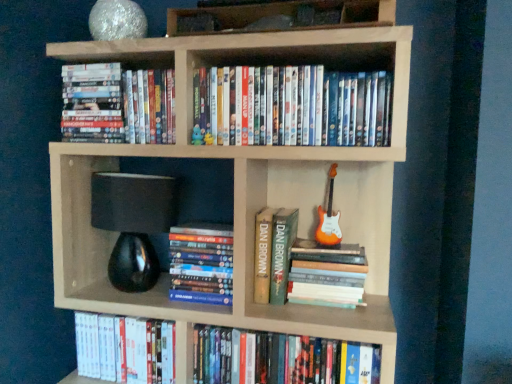
The image size is (512, 384). What do you see at coordinates (292, 106) in the screenshot?
I see `matte plastic dvds at upper center, positioned as the second book in top-to-bottom order` at bounding box center [292, 106].

How much space does hardcover book at center, placed as the fifth book when sorted from top to bottom, occupy vertically?

hardcover book at center, placed as the fifth book when sorted from top to bottom, is 6.28 inches tall.

The height and width of the screenshot is (384, 512). I want to click on hardcover book at lower center, which ranks as the seventh book in top-to-bottom order, so click(x=280, y=358).

What do you see at coordinates (282, 253) in the screenshot?
I see `green hardcover book at center, acting as the 3th book starting from the top` at bounding box center [282, 253].

The image size is (512, 384). I want to click on matte plastic dvds at upper center, positioned as the second book in top-to-bottom order, so click(x=292, y=106).

Based on their sizes in the image, would you say orange glossy electric guitar at right is bigger or smaller than wooden books at upper center?

Considering their sizes, orange glossy electric guitar at right takes up less space than wooden books at upper center.

Considering their positions, is orange glossy electric guitar at right located in front of or behind wooden books at upper center?

orange glossy electric guitar at right is behind wooden books at upper center.

Based on their positions, is orange glossy electric guitar at right located to the left or right of wooden books at upper center?

Clearly, orange glossy electric guitar at right is on the right of wooden books at upper center in the image.

Is hardcover book at center, placed as the fifth book when sorted from top to bottom, a part of matte blue plush toy at upper center?

No.

Is matte blue plush toy at upper center wider or thinner than hardcover book at center, positioned as the third book in bottom-to-top order?

Considering their sizes, matte blue plush toy at upper center looks slimmer than hardcover book at center, positioned as the third book in bottom-to-top order.

Can you confirm if matte blue plush toy at upper center is positioned to the left of hardcover book at center, positioned as the third book in bottom-to-top order?

Yes.

From a real-world perspective, which is physically above, matte blue plush toy at upper center or hardcover book at center, placed as the fifth book when sorted from top to bottom?

From a 3D spatial view, matte blue plush toy at upper center is above.

Locate an element on the screen. The height and width of the screenshot is (384, 512). guitar above the natural wood bookcase at upper center (from a real-world perspective) is located at coordinates (329, 216).

Is natural wood bookcase at upper center a part of orange glossy electric guitar at right?

No, natural wood bookcase at upper center is not inside orange glossy electric guitar at right.

Between orange glossy electric guitar at right and natural wood bookcase at upper center, which one is positioned in front?

natural wood bookcase at upper center is more forward.

Which object is thinner, orange glossy electric guitar at right or natural wood bookcase at upper center?

Thinner between the two is orange glossy electric guitar at right.

Considering the points (281, 264) and (320, 222), which point is in front, point (281, 264) or point (320, 222)?

Point (281, 264)

Find the location of a particular element. book that is the 1st one when counting downward from the orange glossy electric guitar at right (from the image's perspective) is located at coordinates pos(282,253).

Is green hardcover book at center, acting as the 3th book starting from the top, not close to orange glossy electric guitar at right?

No, green hardcover book at center, acting as the 3th book starting from the top, is not far from orange glossy electric guitar at right.

From a real-world perspective, who is located higher, white glossy dvds at upper left, positioned as the 1th book in top-to-bottom order, or matte plastic dvds at upper center, the 6th book in the bottom-to-top sequence?

white glossy dvds at upper left, positioned as the 1th book in top-to-bottom order, is physically above.

Considering the sizes of objects white glossy dvds at upper left, positioned as the 1th book in top-to-bottom order, and matte plastic dvds at upper center, positioned as the second book in top-to-bottom order, in the image provided, who is taller, white glossy dvds at upper left, positioned as the 1th book in top-to-bottom order, or matte plastic dvds at upper center, positioned as the second book in top-to-bottom order,?

Standing taller between the two is white glossy dvds at upper left, positioned as the 1th book in top-to-bottom order.

From the picture: Is white glossy dvds at upper left, positioned as the 1th book in top-to-bottom order, positioned with its back to matte plastic dvds at upper center, the 6th book in the bottom-to-top sequence?

No, white glossy dvds at upper left, positioned as the 1th book in top-to-bottom order,'s orientation is not away from matte plastic dvds at upper center, the 6th book in the bottom-to-top sequence.

This screenshot has width=512, height=384. I want to click on the 1st book directly beneath the white glossy dvds at upper left, positioned as the 7th book in bottom-to-top order (from a real-world perspective), so click(x=292, y=106).

From the image's perspective, which one is positioned lower, matte blue plush toy at upper center or wooden books at upper center?

From the image's view, matte blue plush toy at upper center is below.

In the scene shown: Looking at the image, does matte blue plush toy at upper center seem bigger or smaller compared to wooden books at upper center?

Clearly, matte blue plush toy at upper center is smaller in size than wooden books at upper center.

Based on the photo, is the position of matte blue plush toy at upper center more distant than that of wooden books at upper center?

Yes, it is.

From a real-world perspective, who is located higher, matte plastic dvds at upper center, positioned as the second book in top-to-bottom order, or white glossy dvds at upper left, positioned as the 1th book in top-to-bottom order?

In real-world perspective, white glossy dvds at upper left, positioned as the 1th book in top-to-bottom order, is above.

Would you say matte plastic dvds at upper center, the 6th book in the bottom-to-top sequence, is a long distance from white glossy dvds at upper left, positioned as the 7th book in bottom-to-top order?

They are positioned close to each other.

Can white glossy dvds at upper left, positioned as the 1th book in top-to-bottom order, be found inside matte plastic dvds at upper center, positioned as the second book in top-to-bottom order?

Actually, white glossy dvds at upper left, positioned as the 1th book in top-to-bottom order, is outside matte plastic dvds at upper center, positioned as the second book in top-to-bottom order.

Where is `guitar that is below the wooden books at upper center (from the image's perspective)`? guitar that is below the wooden books at upper center (from the image's perspective) is located at coordinates (329, 216).

From a real-world perspective, which book is the 3rd one underneath the matte blue plush toy at upper center? Please provide its 2D coordinates.

[(328, 278)]

Based on their spatial positions, is wooden books at upper center or hardcover book at center, placed as the fifth book when sorted from top to bottom, closer to orange glossy electric guitar at right?

Among the two, hardcover book at center, placed as the fifth book when sorted from top to bottom, is located nearer to orange glossy electric guitar at right.

Estimate the real-world distances between objects in this image. Which object is closer to matte plastic dvds at upper center, the 6th book in the bottom-to-top sequence, hardcover book at center, positioned as the third book in bottom-to-top order, or white glossy dvds at upper left, positioned as the 1th book in top-to-bottom order?

white glossy dvds at upper left, positioned as the 1th book in top-to-bottom order, is closer to matte plastic dvds at upper center, the 6th book in the bottom-to-top sequence.

Which object lies further to the anchor point green hardcover book at center, acting as the 3th book starting from the top, matte plastic dvds at upper center, positioned as the second book in top-to-bottom order, or matte blue plush toy at upper center?

matte blue plush toy at upper center is further to green hardcover book at center, acting as the 3th book starting from the top.

Considering their positions, is white glossy dvds at upper left, positioned as the 1th book in top-to-bottom order, positioned further to orange glossy electric guitar at right than matte blue plush toy at upper center?

white glossy dvds at upper left, positioned as the 1th book in top-to-bottom order, is further to orange glossy electric guitar at right.

From the image, which object appears to be farther from white glossy dvd at lower left, which is counted as the second book, starting from the bottom, wooden books at upper center or matte blue plush toy at upper center?

wooden books at upper center.

Considering their positions, is green hardcover book at center, acting as the 3th book starting from the top, positioned closer to natural wood bookcase at upper center than hardcover book at lower center, which ranks as the seventh book in top-to-bottom order?

hardcover book at lower center, which ranks as the seventh book in top-to-bottom order, lies closer to natural wood bookcase at upper center than the other object.

From the image, which object appears to be farther from wooden books at upper center, natural wood bookcase at upper center or white glossy dvd at lower left, which is counted as the second book, starting from the bottom?

Based on the image, white glossy dvd at lower left, which is counted as the second book, starting from the bottom, appears to be further to wooden books at upper center.

Based on their spatial positions, is matte blue plush toy at upper center or white glossy dvd at lower left, which is counted as the second book, starting from the bottom, closer to natural wood bookcase at upper center?

Based on the image, white glossy dvd at lower left, which is counted as the second book, starting from the bottom, appears to be nearer to natural wood bookcase at upper center.

The image size is (512, 384). Identify the location of bookcase between matte blue plush toy at upper center and hardcover book at center, placed as the fifth book when sorted from top to bottom, in the vertical direction. (242, 188).

At what (x,y) coordinates should I click in order to perform the action: click on bookcase located between white glossy dvd at lower left, which appears as the 6th book when viewed from the top, and hardcover book at lower center, the first book positioned from the bottom, in the left-right direction. Please return your answer as a coordinate pair (x, y). The image size is (512, 384). Looking at the image, I should click on (242, 188).

Locate an element on the screen. This screenshot has width=512, height=384. toy between matte plastic dvds at upper center, positioned as the second book in top-to-bottom order, and white glossy dvd at lower left, which appears as the 6th book when viewed from the top, vertically is located at coordinates (198, 135).

At what (x,y) coordinates should I click in order to perform the action: click on toy between white glossy dvds at upper left, positioned as the 1th book in top-to-bottom order, and matte plastic dvds at upper center, positioned as the second book in top-to-bottom order. Please return your answer as a coordinate pair (x, y). Looking at the image, I should click on (198, 135).